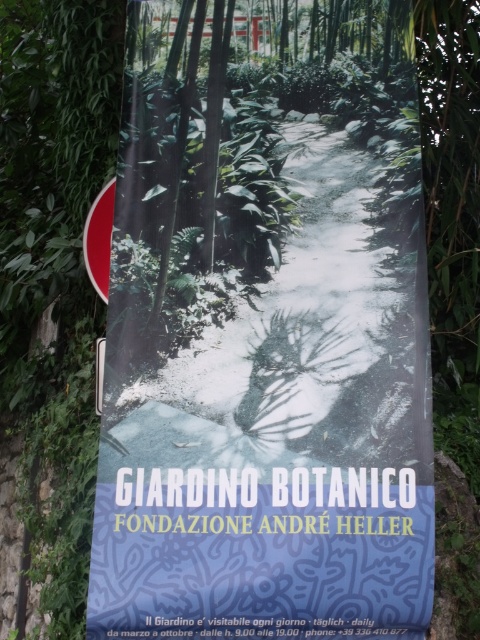
You are a visitor at the botanical garden and want to read the matte black signboard at center and the matte red sign at upper left. Which sign is located lower in the image?

The matte black signboard at center is positioned under the matte red sign at upper left, so it is located lower in the image.

You are a visitor at the botanical garden and want to read both the matte black signboard at center and the matte red sign at upper left. Which sign will you need to look up higher to read?

The matte black signboard at center has a greater height compared to the matte red sign at upper left, so you will need to look up higher to read the matte black signboard at center.

You are designing a layout for a promotional banner and need to ensure that the matte black signboard at center and the matte red sign at upper left are visible from a distance. Based on their sizes, which one is more likely to be noticed first?

The matte black signboard at center is larger in size compared to the matte red sign at upper left, so it will be noticed first due to its larger size.